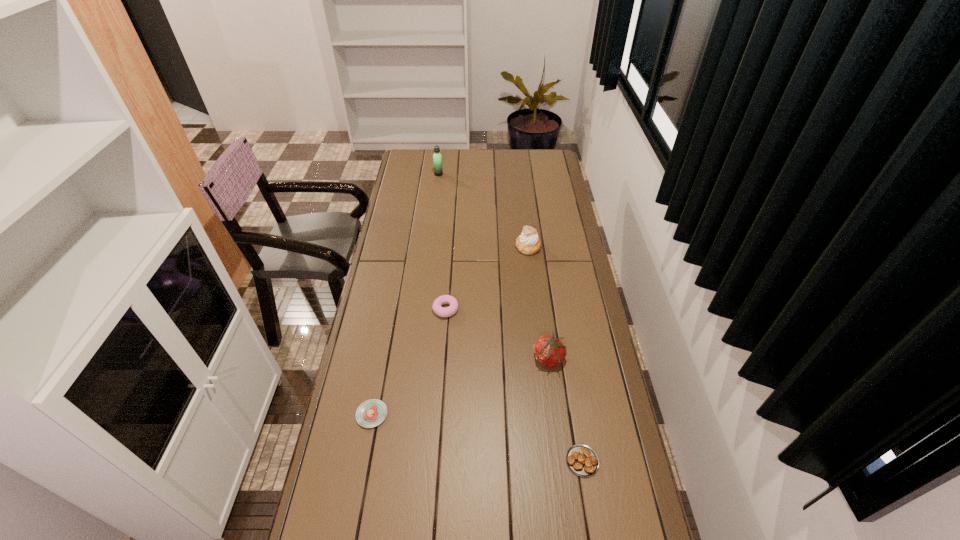
Identify the location of the tallest object. The image size is (960, 540). (437, 158).

Identify the location of thermos bottle. The image size is (960, 540). (437, 158).

In order to click on the fifth nearest object in this screenshot , I will do `click(528, 243)`.

Find the location of `the tallest pastry`. the tallest pastry is located at coordinates (528, 243).

Find the location of `tomato`. tomato is located at coordinates (550, 352).

At what (x,y) coordinates should I click in order to perform the action: click on the third tallest object. Please return your answer as a coordinate pair (x, y). Looking at the image, I should click on [550, 352].

Where is `the third nearest pastry`? the third nearest pastry is located at coordinates (437, 307).

The image size is (960, 540). What are the coordinates of `the third pastry from right to left` in the screenshot? It's located at (437, 307).

Where is `the leftmost pastry`? This screenshot has width=960, height=540. the leftmost pastry is located at coordinates (371, 413).

The image size is (960, 540). Find the location of `the second nearest object`. the second nearest object is located at coordinates (371, 413).